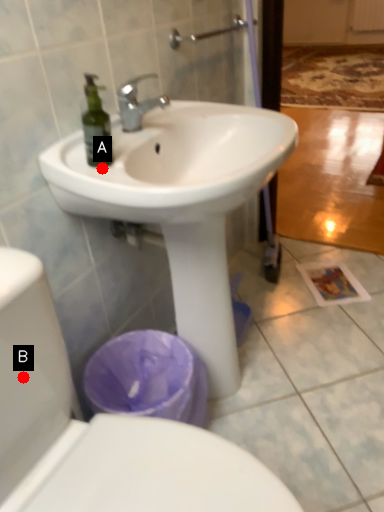
Question: Two points are circled on the image, labeled by A and B beside each circle. Among these points, which one is nearest to the camera?

Choices:
 (A) A is closer
 (B) B is closer

Answer: (B)